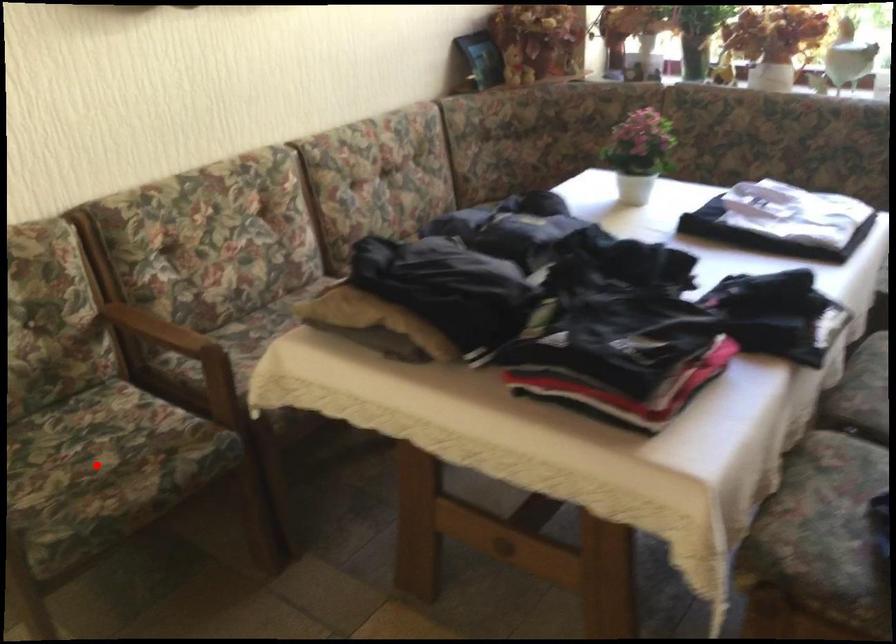
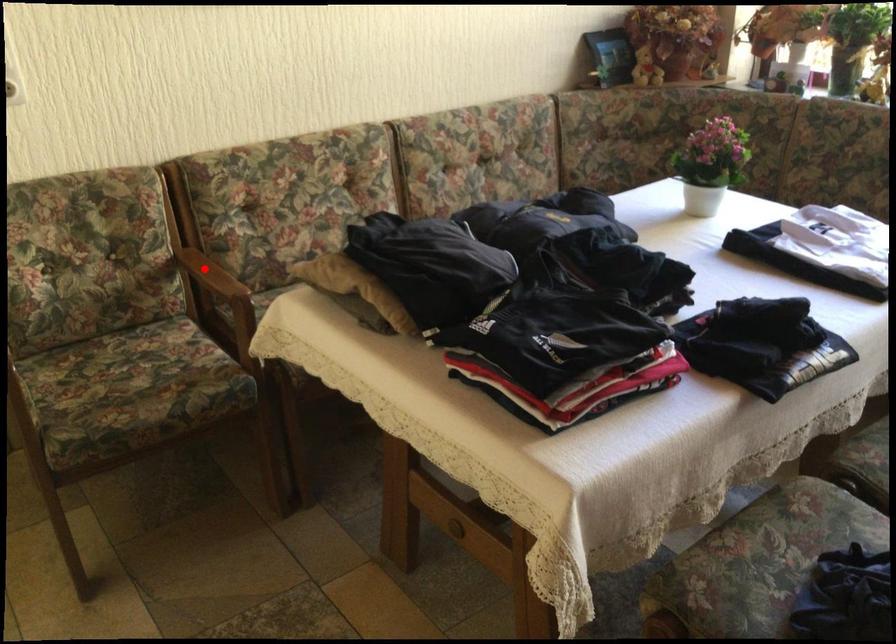
I am providing you with two images of the same scene from different viewpoints. A red point is marked on the first image and another point is marked on the second image. Are the points marked in image1 and image2 representing the same 3D position?

No